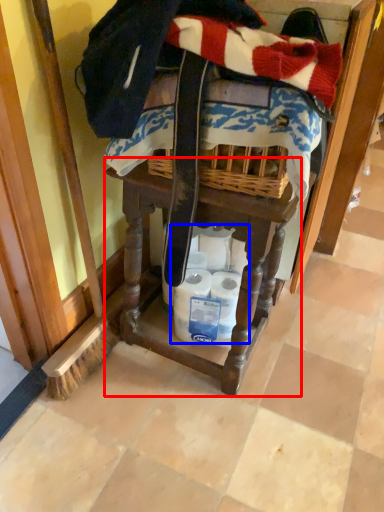
Question: Among these objects, which one is farthest to the camera, vanity (highlighted by a red box) or toilet paper (highlighted by a blue box)?

Choices:
 (A) vanity
 (B) toilet paper

Answer: (B)